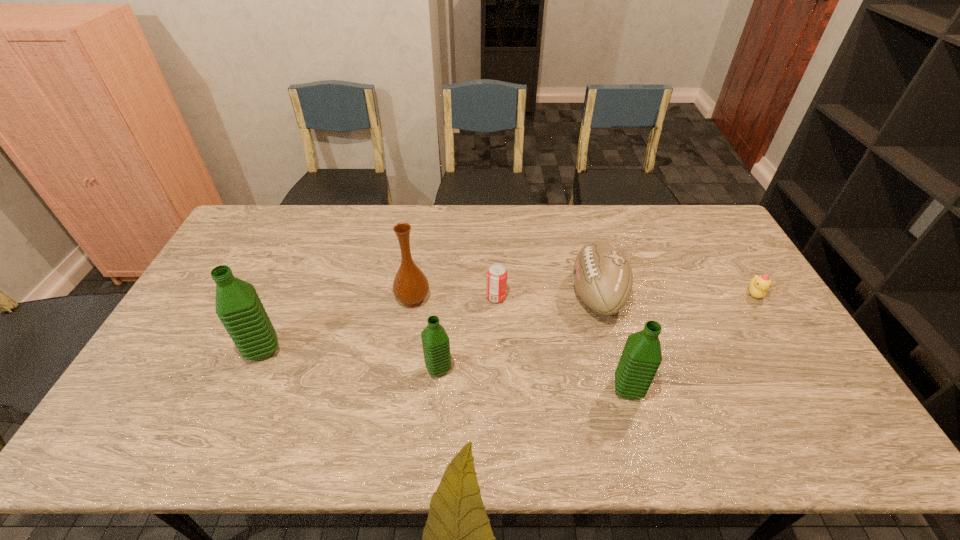
Locate an element on the screen. The width and height of the screenshot is (960, 540). the leftmost water bottle is located at coordinates (238, 306).

Locate an element on the screen. The width and height of the screenshot is (960, 540). the leftmost object is located at coordinates (238, 306).

This screenshot has height=540, width=960. I want to click on the fourth shortest object, so click(x=436, y=346).

Locate an element on the screen. The width and height of the screenshot is (960, 540). the shortest water bottle is located at coordinates (436, 346).

Identify the location of the second tallest water bottle. Image resolution: width=960 pixels, height=540 pixels. (641, 357).

You are a GUI agent. You are given a task and a screenshot of the screen. Output one action in this format:
    pyautogui.click(x=<x>, y=<y>)
    Task: Click on the duckling
    This screenshot has width=960, height=540.
    Given the screenshot: What is the action you would take?
    pyautogui.click(x=758, y=286)

Where is `the shortest object`? The image size is (960, 540). the shortest object is located at coordinates (758, 286).

The height and width of the screenshot is (540, 960). What are the coordinates of `the fourth object from left to right` in the screenshot? It's located at (496, 278).

Image resolution: width=960 pixels, height=540 pixels. Identify the location of soda can. (496, 278).

I want to click on the fifth tallest object, so click(x=602, y=275).